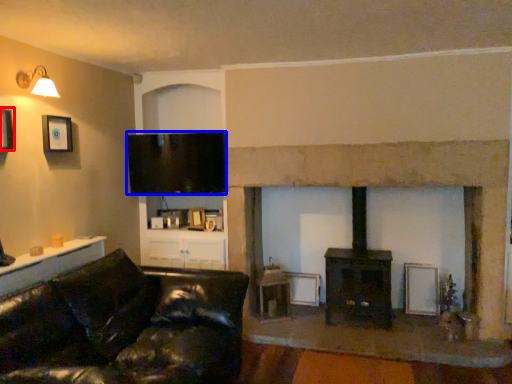
Question: Which object appears farthest to the camera in this image, picture frame (highlighted by a red box) or television (highlighted by a blue box)?

Choices:
 (A) picture frame
 (B) television

Answer: (B)